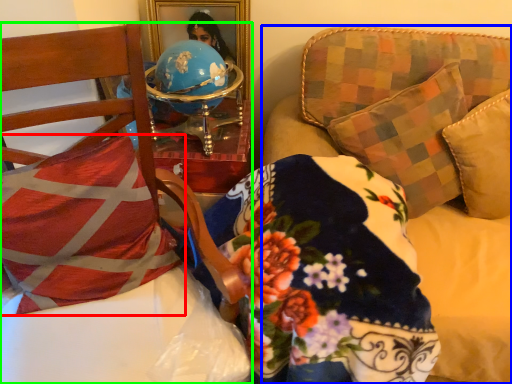
Question: Based on their relative distances, which object is nearer to pillow (highlighted by a red box)? Choose from studio couch (highlighted by a blue box) and furniture (highlighted by a green box).

Choices:
 (A) studio couch
 (B) furniture

Answer: (B)